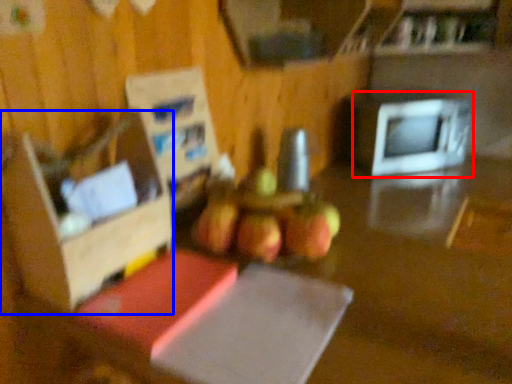
Question: Among these objects, which one is farthest to the camera, microwave oven (highlighted by a red box) or box (highlighted by a blue box)?

Choices:
 (A) microwave oven
 (B) box

Answer: (A)